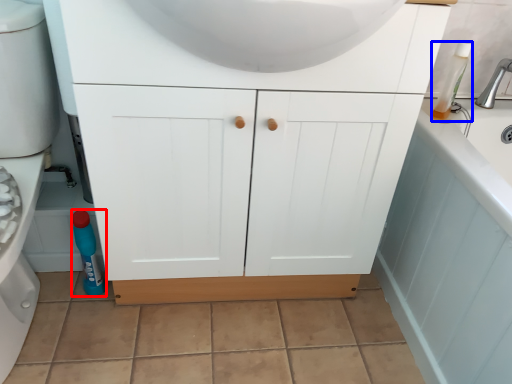
Question: Which of the following is the farthest to the observer, bottle (highlighted by a red box) or cleaning product (highlighted by a blue box)?

Choices:
 (A) bottle
 (B) cleaning product

Answer: (A)